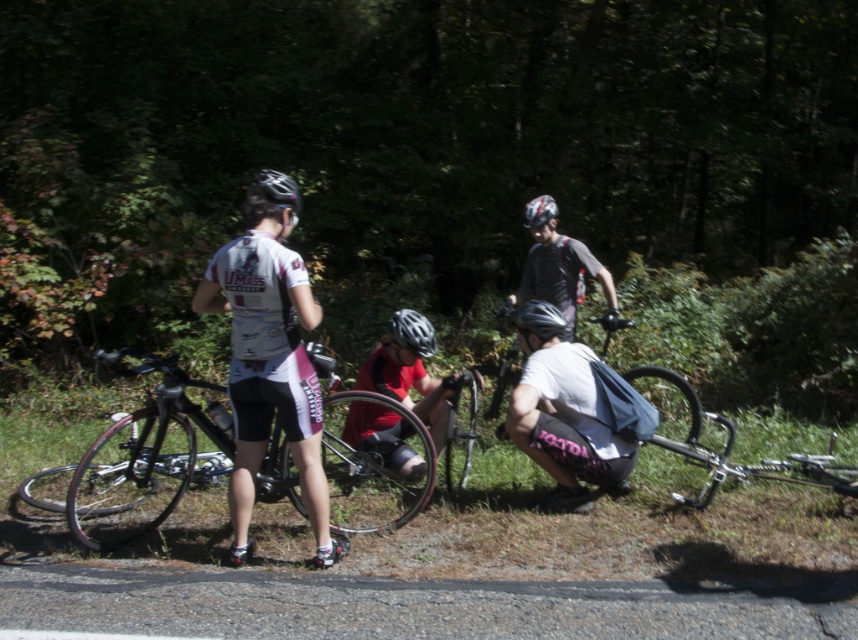
Question: Is shiny black bicycle at center closer to the viewer compared to white matte helmet at center?

Choices:
 (A) no
 (B) yes

Answer: (B)

Question: Is matte black helmet at center bigger than matte black helmet at upper center?

Choices:
 (A) no
 (B) yes

Answer: (B)

Question: Among these points, which one is nearest to the camera?

Choices:
 (A) (242, 534)
 (B) (517, 417)
 (C) (532, 218)
 (D) (286, 193)

Answer: (D)

Question: Among these points, which one is nearest to the camera?

Choices:
 (A) (535, 225)
 (B) (248, 186)

Answer: (A)

Question: In this image, where is white matte helmet at center located relative to matte black helmet at center?

Choices:
 (A) right
 (B) left

Answer: (A)

Question: Which object is positioned closest to the white matte bicycle helmet at center?

Choices:
 (A) shiny black bicycle at center
 (B) white matte helmet at center
 (C) white jersey at center
 (D) shiny silver helmet at center

Answer: (B)